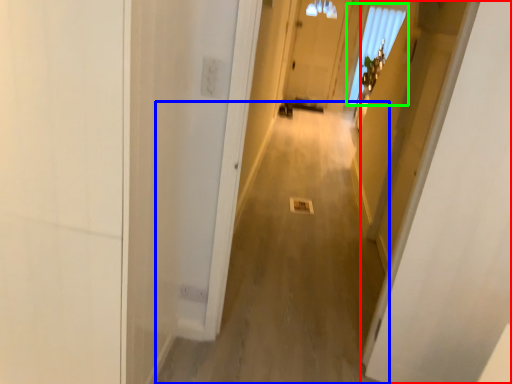
Question: Which is farther away from door (highlighted by a red box)? alley (highlighted by a blue box) or window (highlighted by a green box)?

Choices:
 (A) alley
 (B) window

Answer: (B)